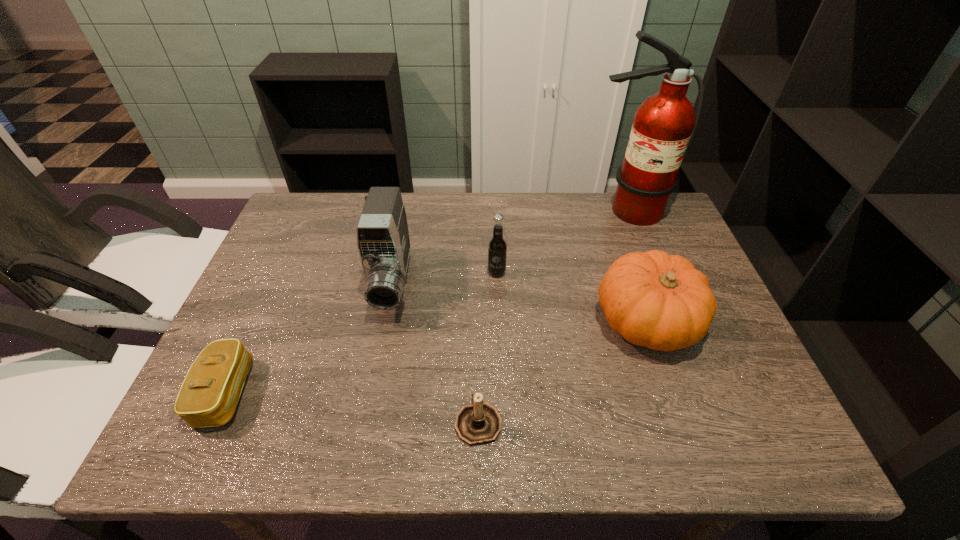
Where is `unoccupied position between the fifth object from right to left and the clutch bag`? This screenshot has height=540, width=960. unoccupied position between the fifth object from right to left and the clutch bag is located at coordinates tap(309, 338).

Locate an element on the screen. This screenshot has width=960, height=540. vacant area that lies between the pumpkin and the camcorder is located at coordinates (519, 303).

This screenshot has width=960, height=540. I want to click on empty space between the fifth shortest object and the root beer, so click(444, 279).

Identify the location of blank region between the shortest object and the tallest object. Image resolution: width=960 pixels, height=540 pixels. (426, 302).

This screenshot has height=540, width=960. What are the coordinates of `unoccupied position between the pumpkin and the clutch bag` in the screenshot? It's located at (436, 357).

You are a GUI agent. You are given a task and a screenshot of the screen. Output one action in this format:
    pyautogui.click(x=<x>, y=<y>)
    Task: Click on the vacant area that lies between the root beer and the fifth tallest object
    
    Given the screenshot: What is the action you would take?
    pyautogui.click(x=488, y=347)

I want to click on empty space that is in between the second shortest object and the pumpkin, so click(563, 372).

What are the coordinates of `blank region between the root beer and the pumpkin` in the screenshot? It's located at (571, 298).

Where is `object that is the second closest to the leftmost object`? Image resolution: width=960 pixels, height=540 pixels. object that is the second closest to the leftmost object is located at coordinates (479, 423).

The width and height of the screenshot is (960, 540). What are the coordinates of `object that can be found as the second closest to the candle holder` in the screenshot? It's located at (660, 301).